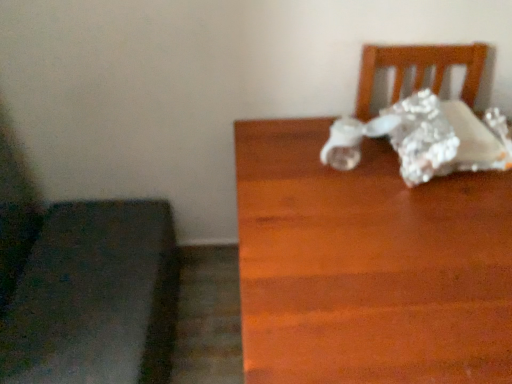
The image size is (512, 384). Find the location of `blank space above dark gray fabric cushion at lower left (from a real-world perspective)`. blank space above dark gray fabric cushion at lower left (from a real-world perspective) is located at coordinates (86, 273).